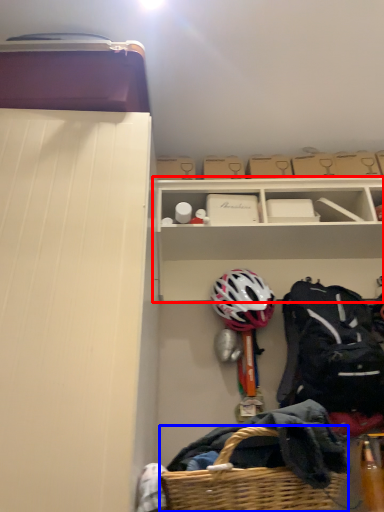
Question: Among these objects, which one is nearest to the camera, shelf (highlighted by a red box) or picnic basket (highlighted by a blue box)?

Choices:
 (A) shelf
 (B) picnic basket

Answer: (B)